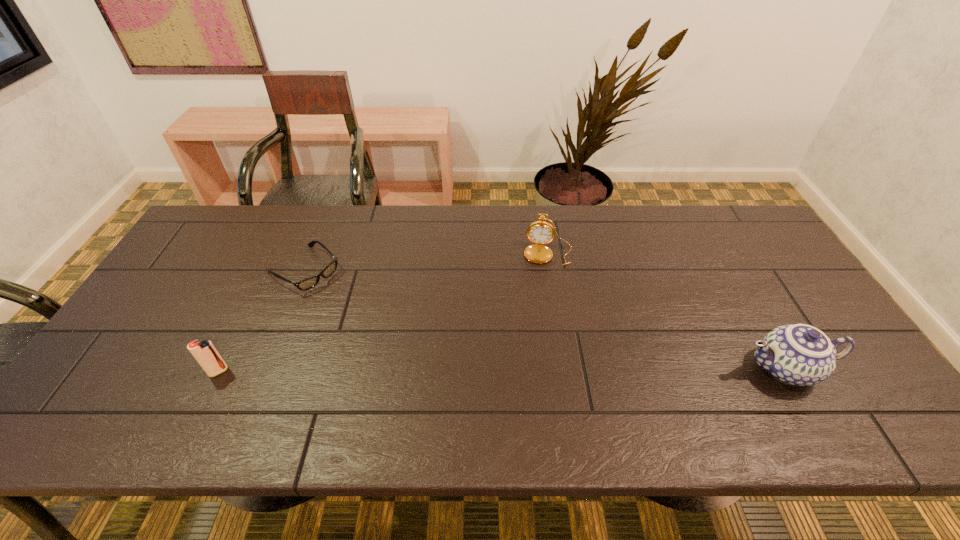
Identify the location of free space at the far edge of the desktop. The height and width of the screenshot is (540, 960). (267, 242).

This screenshot has height=540, width=960. What are the coordinates of `vacant area at the near edge of the desktop` in the screenshot? It's located at (224, 380).

Locate an element on the screen. Image resolution: width=960 pixels, height=540 pixels. vacant area at the left edge of the desktop is located at coordinates (214, 264).

The width and height of the screenshot is (960, 540). What are the coordinates of `vacant space at the right edge of the desktop` in the screenshot? It's located at (805, 297).

I want to click on vacant area at the far left corner of the desktop, so click(231, 219).

Where is `free spot at the near left corner of the desktop`? The image size is (960, 540). free spot at the near left corner of the desktop is located at coordinates (120, 371).

Find the location of `free point between the pocket watch and the spectacles`. free point between the pocket watch and the spectacles is located at coordinates (426, 261).

Locate an element on the screen. This screenshot has height=540, width=960. free space between the shortest object and the igniter is located at coordinates click(x=261, y=321).

In order to click on free area in between the spectacles and the chinaware in this screenshot , I will do pyautogui.click(x=544, y=319).

Locate an element on the screen. free spot between the pocket watch and the chinaware is located at coordinates (667, 311).